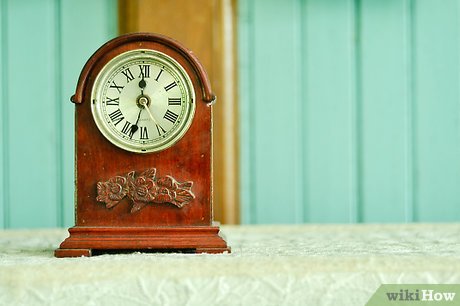
The image size is (460, 306). I want to click on rim around top of clock, so click(x=86, y=62).